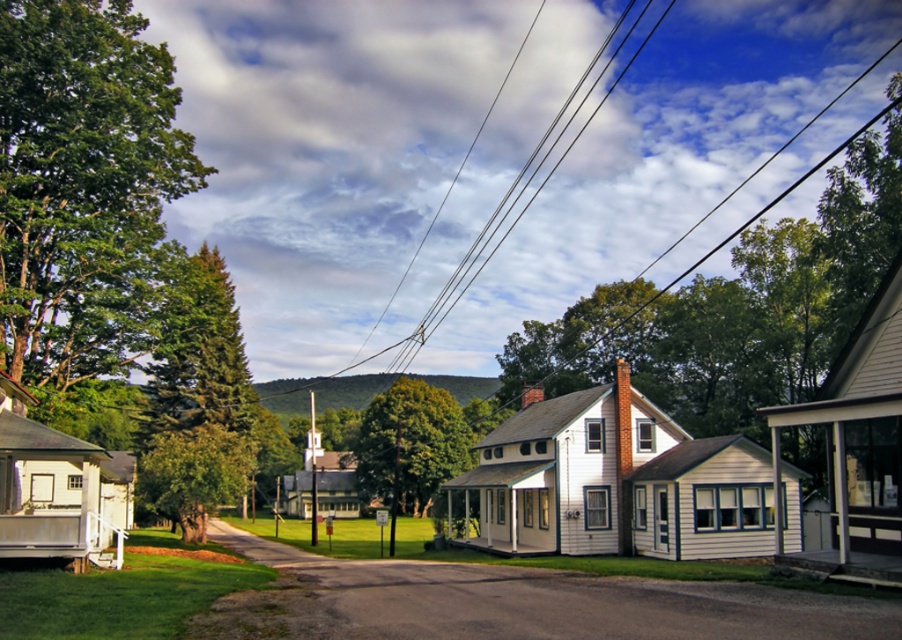
You are driving a car that is 5 meters long. You want to make a U turn on the road. Can you do it without crossing the green leafy tree at center or the smooth asphalt driveway at center?

The distance between the smooth asphalt driveway at center and the green leafy tree at center is 11.68 meters. Since your car is 5 meters long, you can safely make a U turn within this space without crossing either object.

You are standing at the point labeled point [794,589] on the right side of the road. You want to walk to the point labeled point [60,65] on the left side of the road. Which direction should you move first to reach your destination?

You should move towards the left side of the road first because point [60,65] is on the left side of the road, while you are currently at point [794,589] on the right side. Since point [60,65] is behind point [794,589], you need to first move to the left side and then proceed backward along the road to reach it.

You are standing at the intersection of the road and the driveway. If you were to walk directly towards the smooth asphalt driveway at center, in which direction should you head?

Since the smooth asphalt driveway at center is located at point 0.942 on the x axis and 0.579 on the y axis, you should walk towards the direction where the coordinates increase in the x direction and decrease in the y direction to reach it.